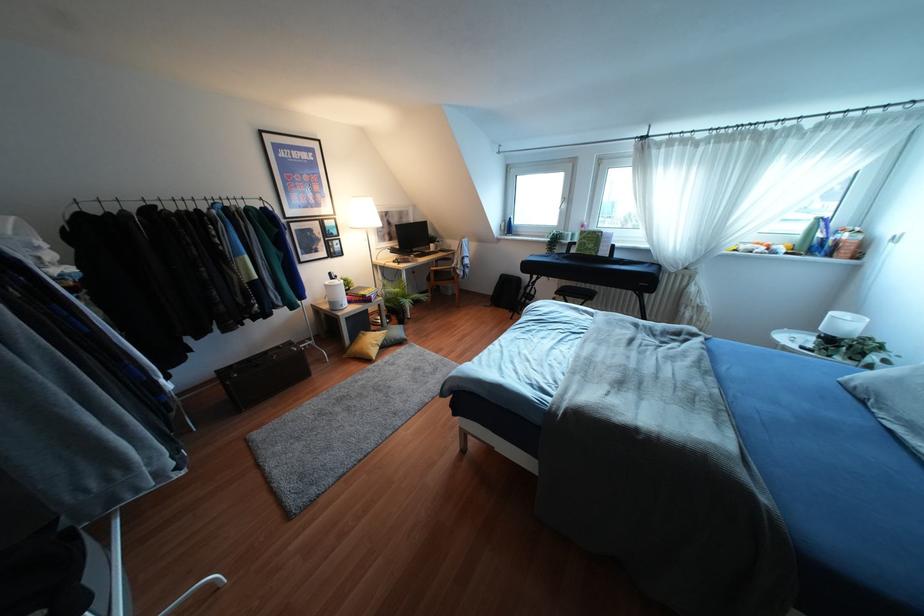
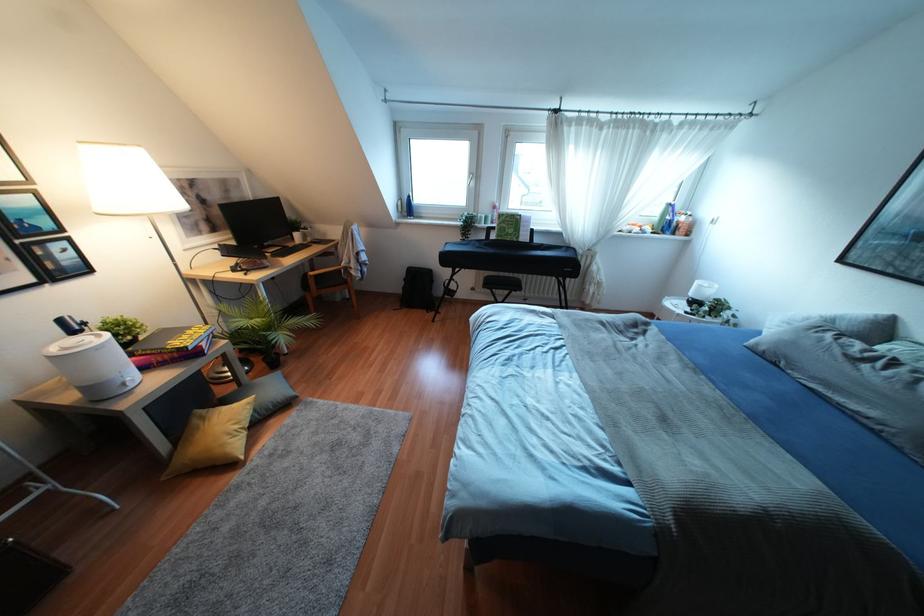
Question: How did the camera likely rotate?

Choices:
 (A) Left
 (B) Right
 (C) Up
 (D) Down

Answer: (B)